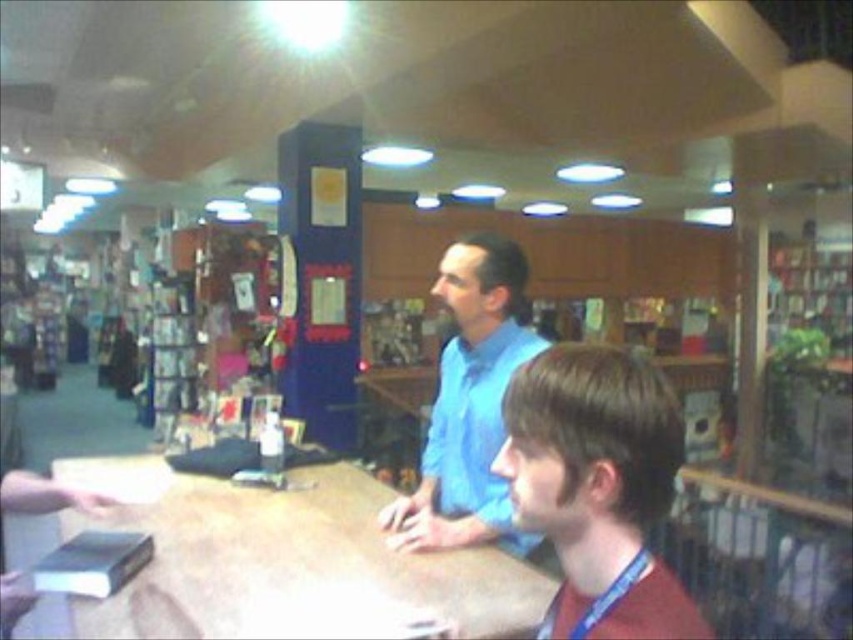
Question: Among these points, which one is farthest from the camera?

Choices:
 (A) (256, 536)
 (B) (611, 400)
 (C) (450, 291)

Answer: (A)

Question: Can you confirm if wooden table at center is wider than blue cotton shirt at center?

Choices:
 (A) no
 (B) yes

Answer: (B)

Question: Which of these objects is positioned closest to the wooden table at center?

Choices:
 (A) blue cotton shirt at center
 (B) brown matte hair at center

Answer: (A)

Question: Is wooden table at center thinner than blue cotton shirt at center?

Choices:
 (A) yes
 (B) no

Answer: (B)

Question: Which object is positioned closest to the wooden table at center?

Choices:
 (A) blue cotton shirt at center
 (B) brown matte hair at center

Answer: (A)

Question: Is brown matte hair at center to the right of blue cotton shirt at center from the viewer's perspective?

Choices:
 (A) yes
 (B) no

Answer: (A)